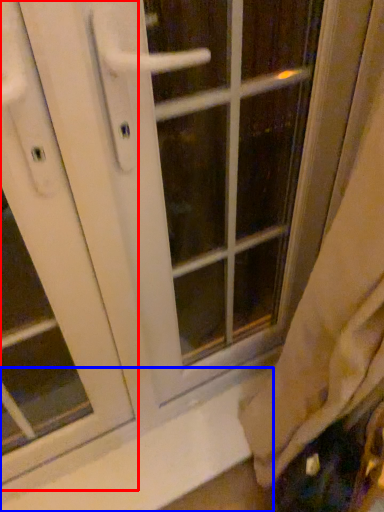
Question: Which object appears closest to the camera in this image, screen door (highlighted by a red box) or window sill (highlighted by a blue box)?

Choices:
 (A) screen door
 (B) window sill

Answer: (A)